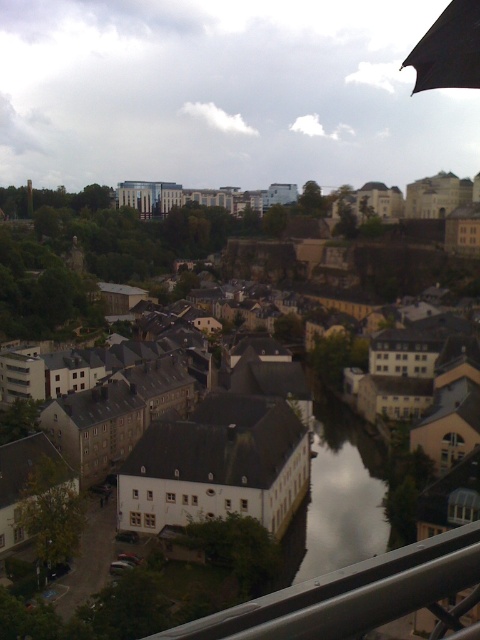
Which of these two, silver metallic rail at lower center or clear glass waterway at center, stands shorter?

Standing shorter between the two is clear glass waterway at center.

Does silver metallic rail at lower center appear over clear glass waterway at center?

Correct, silver metallic rail at lower center is located above clear glass waterway at center.

Where is `silver metallic rail at lower center`? The width and height of the screenshot is (480, 640). silver metallic rail at lower center is located at coordinates (351, 595).

Between light beige stone buildings at center and clear glass waterway at center, which one has more height?

Standing taller between the two is light beige stone buildings at center.

From the picture: Who is more forward, (360, 540) or (320, 518)?

Positioned in front is point (360, 540).

Locate an element on the screen. light beige stone buildings at center is located at coordinates (338, 492).

Image resolution: width=480 pixels, height=640 pixels. Describe the element at coordinates (338, 492) in the screenshot. I see `light beige stone buildings at center` at that location.

Is point (346, 496) closer to viewer compared to point (451, 72)?

No.

Identify the location of light beige stone buildings at center. (338, 492).